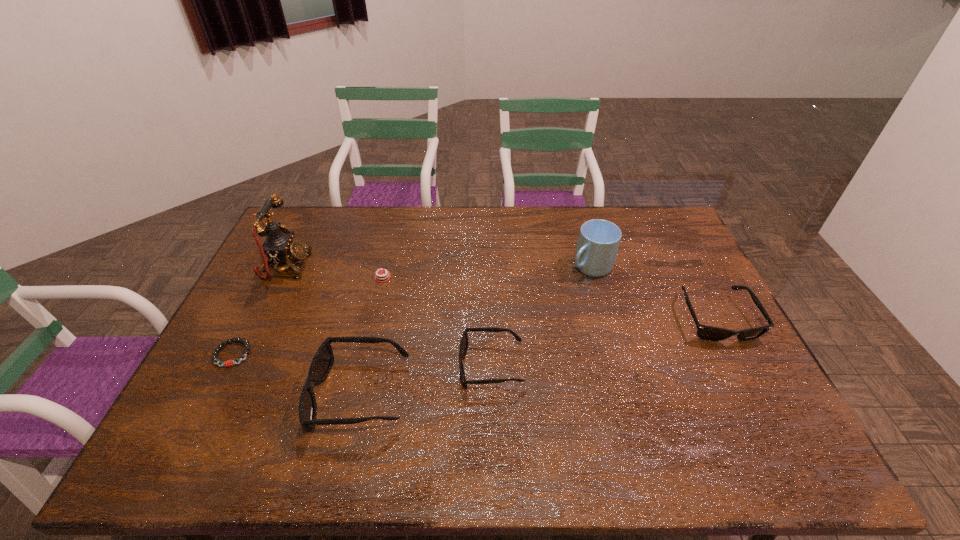
You are a GUI agent. You are given a task and a screenshot of the screen. Output one action in this format:
    pyautogui.click(x=<x>, y=<y>)
    Task: Click on the vacant spot for a new sunglasses to ensure equal spacing
    Image resolution: width=960 pixels, height=540 pixels.
    Given the screenshot: What is the action you would take?
    pyautogui.click(x=610, y=341)